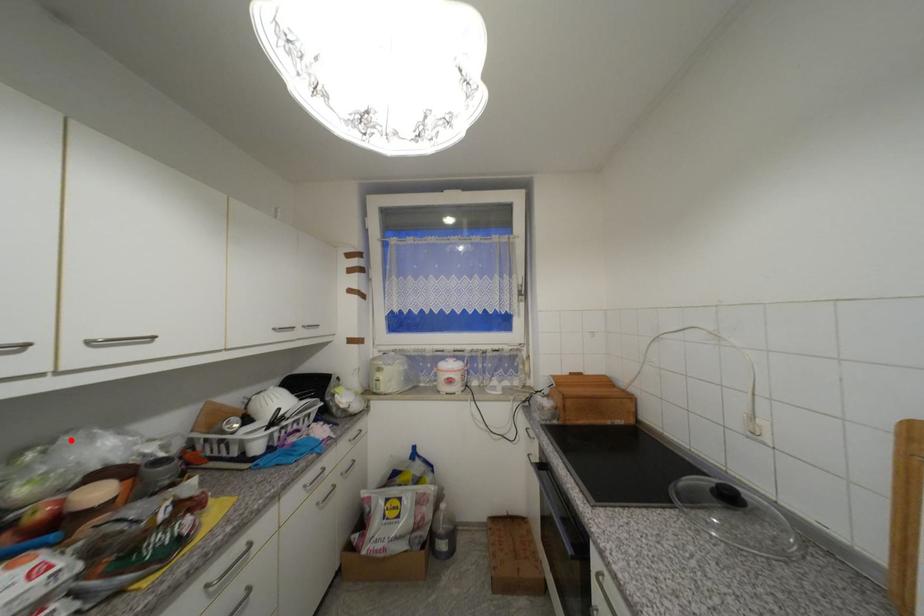
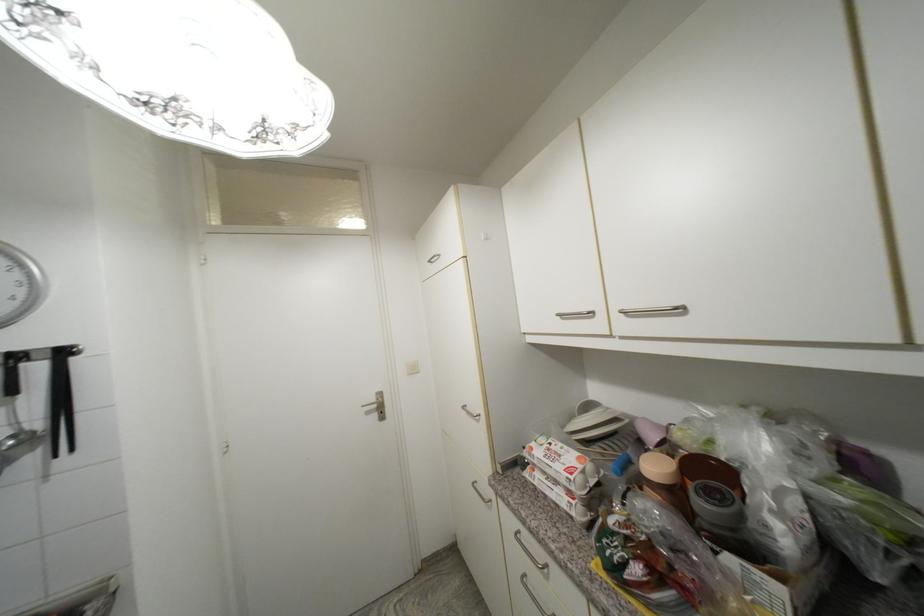
Find the pixel in the second image that matches the highlighted location in the first image.

(730, 410)